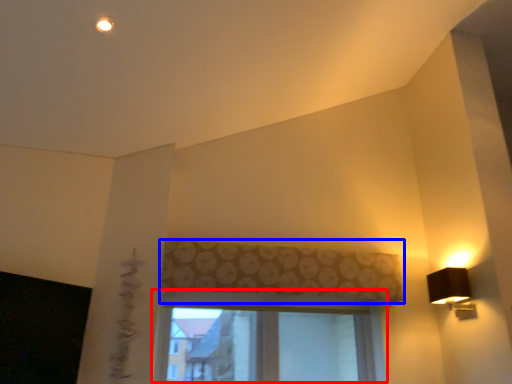
Question: Among these objects, which one is nearest to the camera, window (highlighted by a red box) or curtain (highlighted by a blue box)?

Choices:
 (A) window
 (B) curtain

Answer: (B)